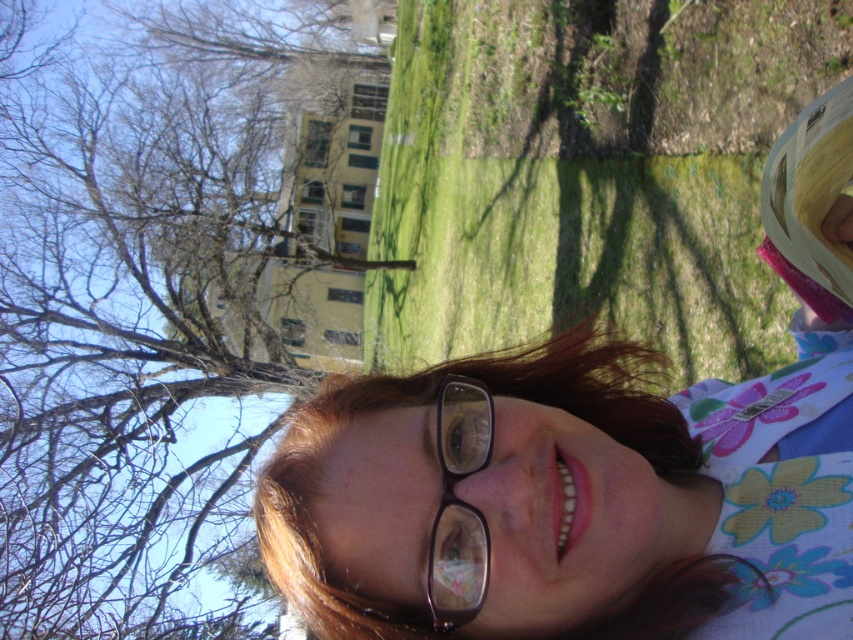
You are a photographer trying to capture a portrait of the person in the scene. You notice the bare branches at upper left and the black plastic glasses at center in the background. Which object is located more to the left side?

The bare branches at upper left is positioned on the left side of black plastic glasses at center, so the bare branches at upper left is more to the left side.